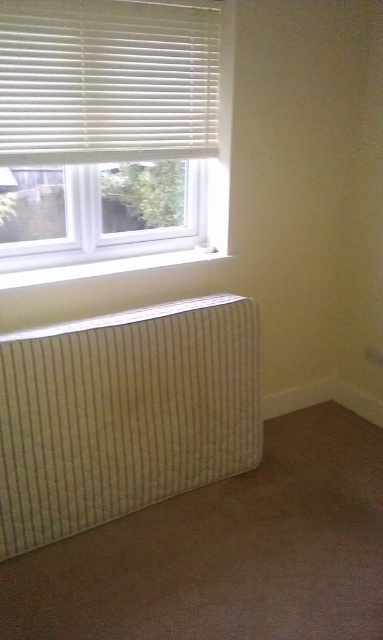
Question: In this image, where is beige corduroy radiator at lower left located relative to white plastic blinds at upper left?

Choices:
 (A) above
 (B) below

Answer: (B)

Question: Among these points, which one is nearest to the camera?

Choices:
 (A) (106, 156)
 (B) (176, 385)

Answer: (A)

Question: Is beige corduroy radiator at lower left below white plastic blinds at upper left?

Choices:
 (A) yes
 (B) no

Answer: (A)

Question: Where is beige corduroy radiator at lower left located in relation to white plastic blinds at upper left in the image?

Choices:
 (A) below
 (B) above

Answer: (A)

Question: Among these points, which one is nearest to the camera?

Choices:
 (A) click(91, 326)
 (B) click(150, 12)

Answer: (A)